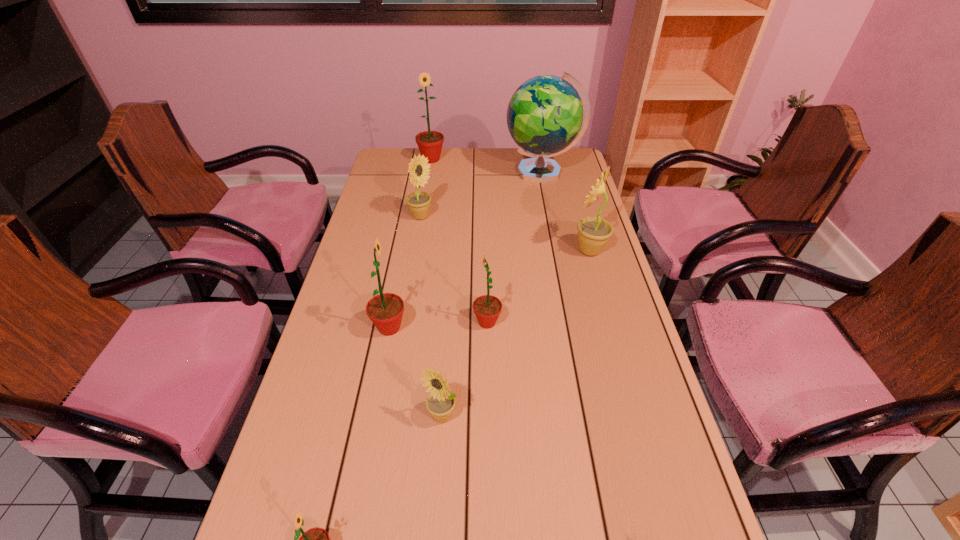
Locate an element on the screen. This screenshot has width=960, height=540. object situated at the far right corner is located at coordinates (544, 116).

This screenshot has height=540, width=960. In the image, there is a desktop. What are the coordinates of `vacant space at the far edge` in the screenshot? It's located at (437, 172).

Identify the location of vacant space at the left edge of the desktop. Image resolution: width=960 pixels, height=540 pixels. (372, 243).

Where is `vacant space at the right edge`? vacant space at the right edge is located at coordinates (612, 382).

Where is `free space between the sixth farthest sunflower and the sixth object from left to right`? This screenshot has width=960, height=540. free space between the sixth farthest sunflower and the sixth object from left to right is located at coordinates (465, 369).

Find the location of a particular element. This screenshot has width=960, height=540. vacant space in between the tallest sunflower and the second smallest yellow sunflower is located at coordinates (426, 188).

This screenshot has height=540, width=960. I want to click on free area in between the third smallest green sunflower and the sixth farthest sunflower, so click(416, 372).

Locate an element on the screen. The image size is (960, 540). free area in between the farthest green sunflower and the second sunflower from right to left is located at coordinates (459, 241).

This screenshot has width=960, height=540. I want to click on free space between the farthest sunflower and the nearest yellow sunflower, so click(x=437, y=288).

Choose which object is the fifth nearest neighbor to the farthest yellow sunflower. Please provide its 2D coordinates. Your answer should be formatted as a tuple, i.e. [(x, y)], where the tuple contains the x and y coordinates of a point satisfying the conditions above.

[(593, 232)]